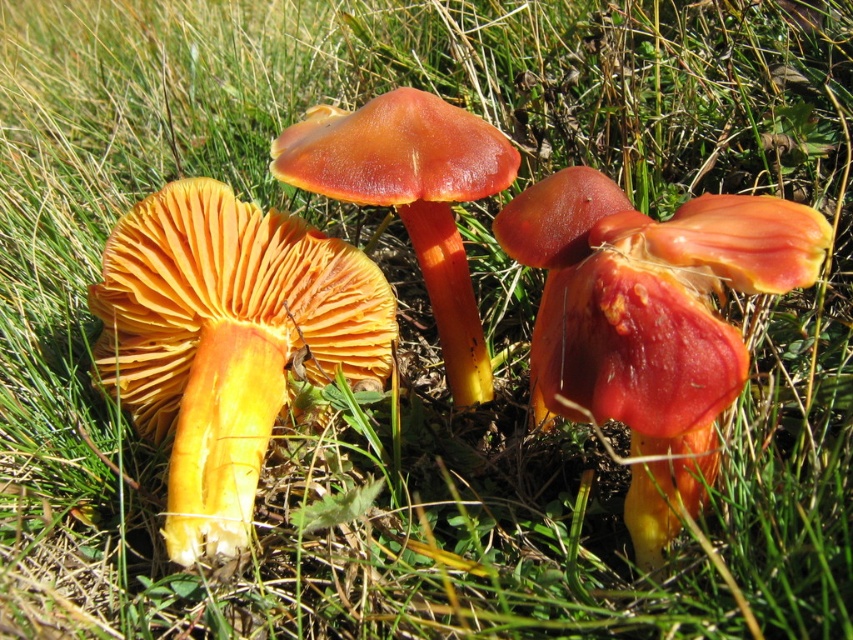
You are a gardener holding a 12 inch ruler. You want to measure the distance between you and the shiny orange mushroom at center. Can you accurately measure this distance with your ruler?

The shiny orange mushroom at center and viewer are 33.60 inches apart from each other. Since the ruler is only 12 inches long, you will need to make multiple measurements to cover the entire distance.